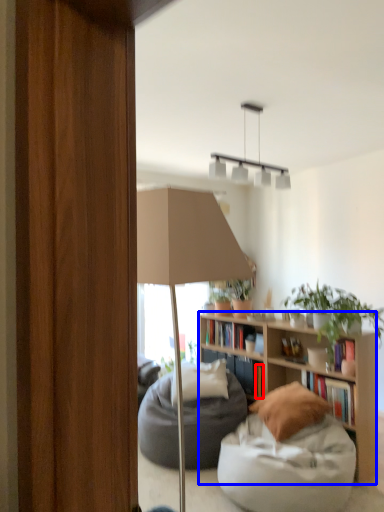
Question: Which object appears closest to the camera in this image, book (highlighted by a red box) or bookcase (highlighted by a blue box)?

Choices:
 (A) book
 (B) bookcase

Answer: (B)